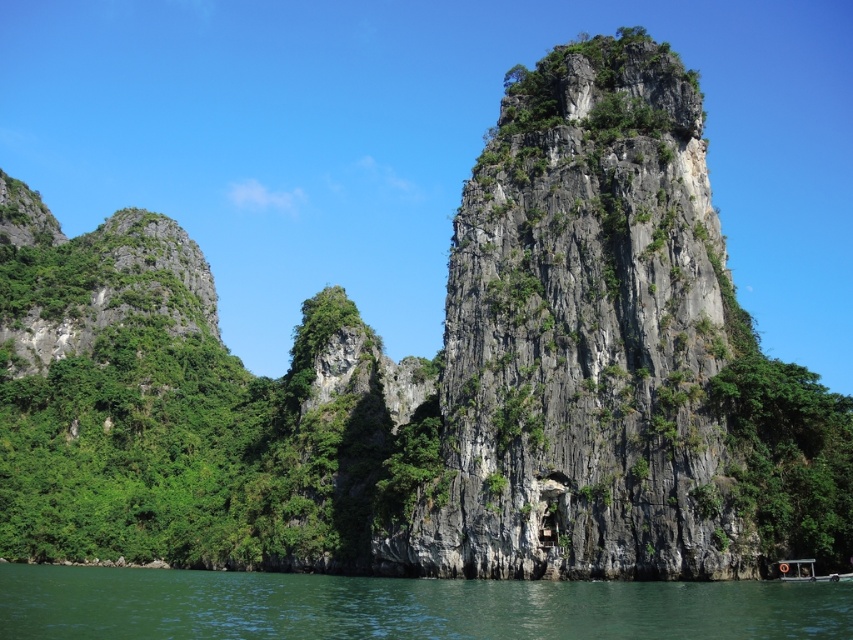
You are a kayaker planning to paddle from the green water at lower center to the gray rocky cliff at center. Given that your kayak can only navigate through spaces narrower than 70 feet, will you be able to reach the cliff?

The gray rocky cliff at center is 65.24 feet from the green water at lower center. Since 65.24 feet is less than 70 feet, your kayak can navigate the distance and reach the cliff.

You are standing at the edge of the water in the image. Which object, the gray rocky cliff at center or the green water at lower center, is higher in elevation?

The gray rocky cliff at center is located above the green water at lower center, so it has a higher elevation.